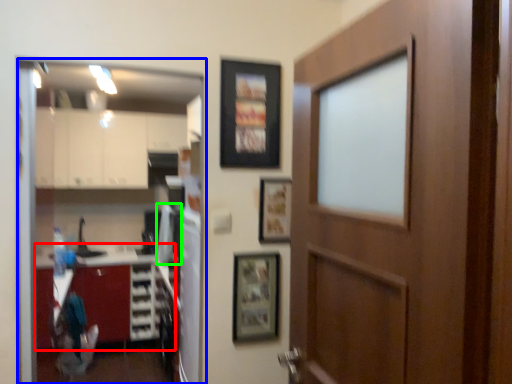
Question: Considering the real-world distances, which object is farthest from cabinetry (highlighted by a red box)? glass door (highlighted by a blue box) or appliance (highlighted by a green box)?

Choices:
 (A) glass door
 (B) appliance

Answer: (B)